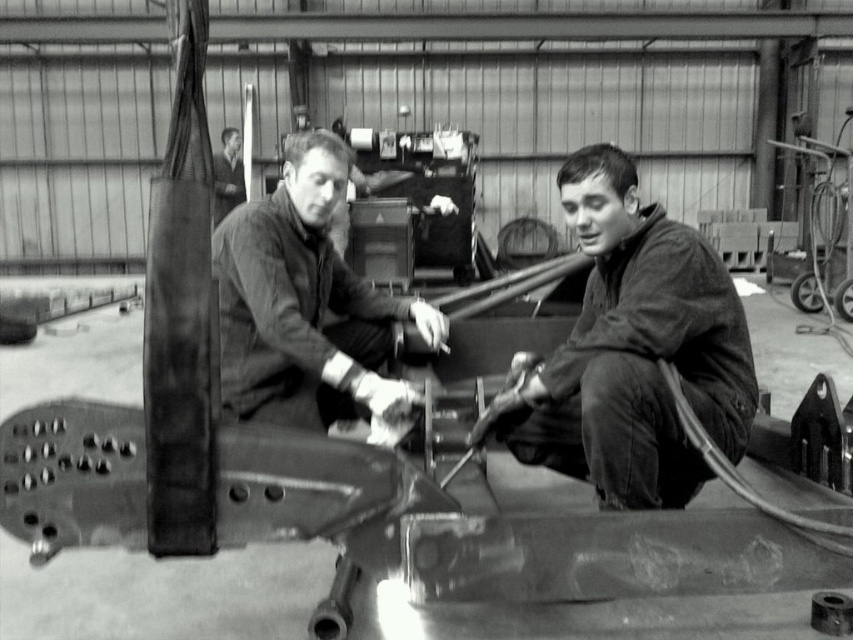
Which is behind, point (642, 294) or point (213, 257)?

Positioned behind is point (213, 257).

Does point (625, 504) come behind point (325, 227)?

No, (625, 504) is in front of (325, 227).

Where is `matte black jacket at lower right`? Image resolution: width=853 pixels, height=640 pixels. matte black jacket at lower right is located at coordinates [635, 349].

Is matte black jacket at center behind smooth leather jacket at upper left?

That is False.

Does matte black jacket at center have a greater height compared to smooth leather jacket at upper left?

In fact, matte black jacket at center may be shorter than smooth leather jacket at upper left.

Find the location of a particular element. This screenshot has height=640, width=853. matte black jacket at center is located at coordinates (305, 305).

Where is `matte black jacket at center`? The image size is (853, 640). matte black jacket at center is located at coordinates [305, 305].

Between point (601, 236) and point (228, 131), which one is positioned behind?

Point (228, 131)

Can you confirm if matte black jacket at lower right is positioned below smooth leather jacket at upper left?

Indeed, matte black jacket at lower right is positioned under smooth leather jacket at upper left.

Who is more forward, (749,426) or (239,148)?

Point (749,426) is in front.

This screenshot has width=853, height=640. Find the location of `matte black jacket at lower right`. matte black jacket at lower right is located at coordinates (635, 349).